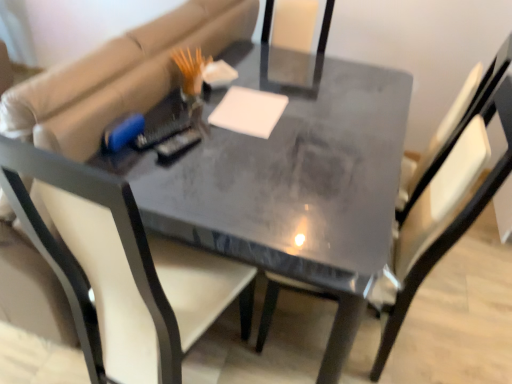
Question: Is white matte notepad at center outside matte gray chair at center, which is the 2th chair from left to right?

Choices:
 (A) yes
 (B) no

Answer: (A)

Question: Does white matte notepad at center contain matte gray chair at center, which is the first chair in right-to-left order?

Choices:
 (A) no
 (B) yes

Answer: (A)

Question: Is white matte notepad at center not near matte gray chair at center, which is the 2th chair from left to right?

Choices:
 (A) yes
 (B) no

Answer: (B)

Question: Considering the relative sizes of white matte notepad at center and matte gray chair at center, which is the 2th chair from left to right, in the image provided, is white matte notepad at center wider than matte gray chair at center, which is the 2th chair from left to right,?

Choices:
 (A) no
 (B) yes

Answer: (A)

Question: From a real-world perspective, is white matte notepad at center located higher than matte gray chair at center, which is the 2th chair from left to right?

Choices:
 (A) no
 (B) yes

Answer: (B)

Question: Can you confirm if white matte notepad at center is positioned to the left of matte gray chair at center, which is the 2th chair from left to right?

Choices:
 (A) yes
 (B) no

Answer: (A)

Question: From a real-world perspective, is matte black chair at center, which is counted as the first chair, starting from the left, beneath matte gray table at center?

Choices:
 (A) no
 (B) yes

Answer: (A)

Question: From the image's perspective, is matte black chair at center, which is counted as the first chair, starting from the left, over matte gray table at center?

Choices:
 (A) no
 (B) yes

Answer: (B)

Question: Is matte black chair at center, which appears as the second chair when viewed from the right, smaller than matte gray table at center?

Choices:
 (A) no
 (B) yes

Answer: (A)

Question: Is matte black chair at center, which appears as the second chair when viewed from the right, aimed at matte gray table at center?

Choices:
 (A) no
 (B) yes

Answer: (A)

Question: Is matte black chair at center, which is counted as the first chair, starting from the left, not close to matte gray table at center?

Choices:
 (A) yes
 (B) no

Answer: (B)

Question: From the image's perspective, is matte black chair at center, which appears as the second chair when viewed from the right, located beneath matte gray table at center?

Choices:
 (A) no
 (B) yes

Answer: (A)

Question: Does matte gray table at center have a larger size compared to matte gray chair at center, which is the first chair in right-to-left order?

Choices:
 (A) no
 (B) yes

Answer: (B)